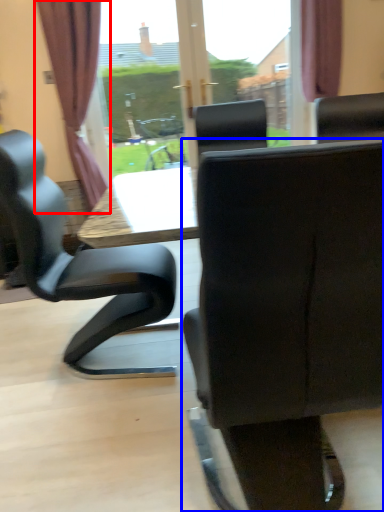
Question: Which object appears farthest to the camera in this image, curtain (highlighted by a red box) or chair (highlighted by a blue box)?

Choices:
 (A) curtain
 (B) chair

Answer: (A)